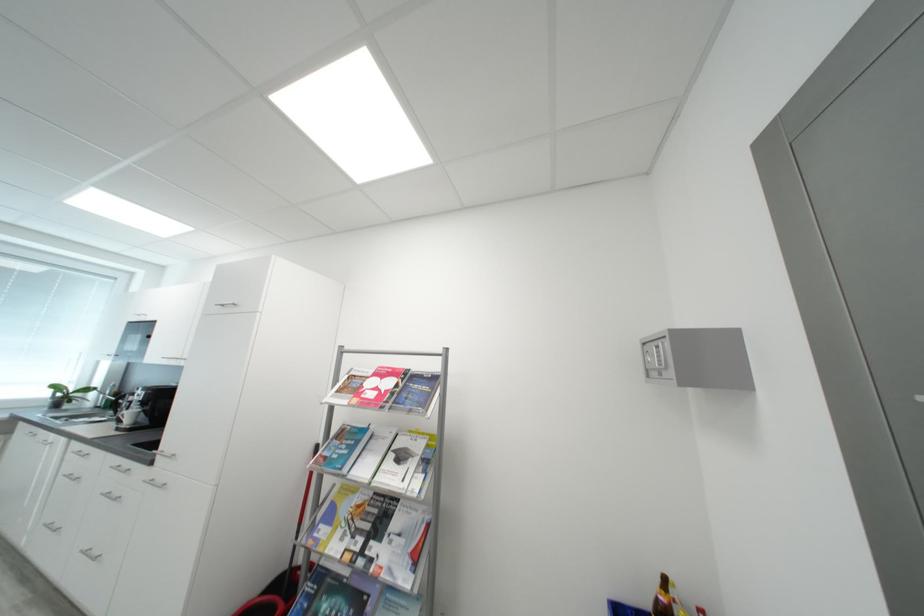
What do you see at coordinates (661, 363) in the screenshot? I see `the safe keypad button` at bounding box center [661, 363].